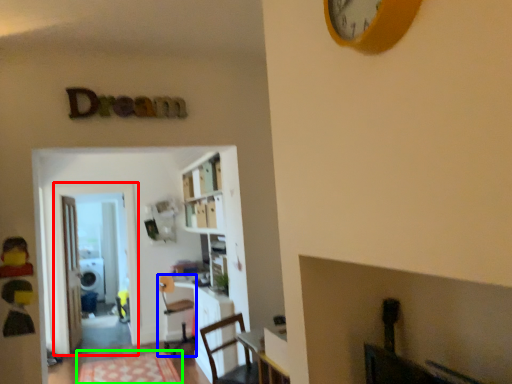
Question: Estimate the real-world distances between objects in this image. Which object is farther from glass door (highlighted by a red box), chair (highlighted by a blue box) or mat (highlighted by a green box)?

Choices:
 (A) chair
 (B) mat

Answer: (B)